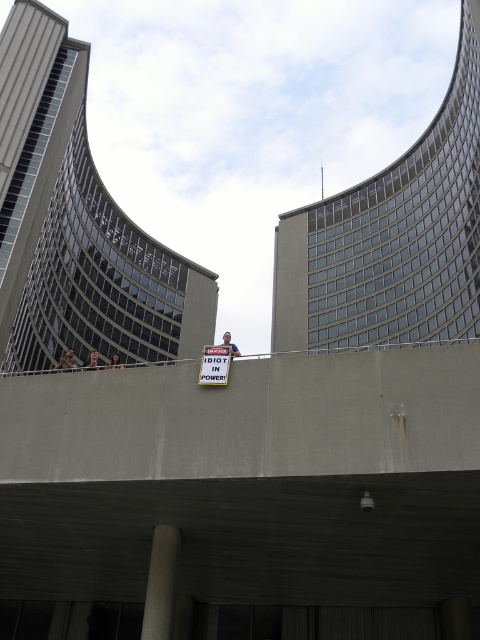
The width and height of the screenshot is (480, 640). What do you see at coordinates (160, 582) in the screenshot? I see `white matte pillar at lower center` at bounding box center [160, 582].

Describe the element at coordinates (160, 582) in the screenshot. I see `white matte pillar at lower center` at that location.

Where is `white matte pillar at lower center`? white matte pillar at lower center is located at coordinates (160, 582).